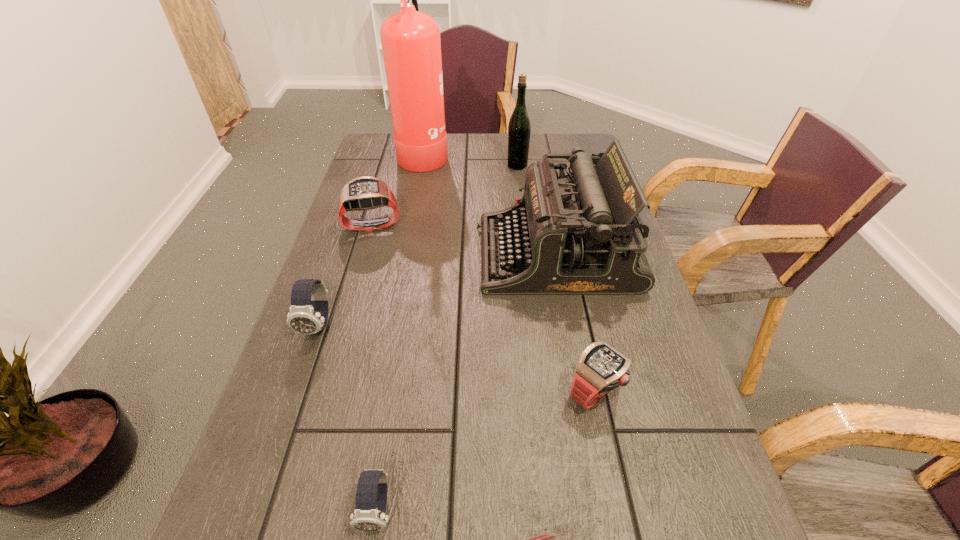
Where is `the right dark watch`? The width and height of the screenshot is (960, 540). the right dark watch is located at coordinates (371, 495).

Find the location of a particular element. This screenshot has width=960, height=540. the fourth farthest watch is located at coordinates (371, 495).

You are a GUI agent. You are given a task and a screenshot of the screen. Output one action in this format:
    pyautogui.click(x=<x>, y=<y>)
    Task: Click on the free point located towards the nozzle of the fire extinguisher
    
    Given the screenshot: What is the action you would take?
    pyautogui.click(x=488, y=153)

In order to click on free spot located on the right of the green beer bottle in this screenshot , I will do `click(584, 165)`.

What are the coordinates of `vacant area situated on the keyboard of the typewriter` in the screenshot? It's located at (384, 255).

Image resolution: width=960 pixels, height=540 pixels. In order to click on vacant space located 0.230m on the keyboard of the typewriter in this screenshot , I will do `click(384, 255)`.

Locate an element on the screen. free region located 0.220m on the keyboard of the typewriter is located at coordinates (388, 255).

The image size is (960, 540). In order to click on vacant space located on the front of the farthest watch in this screenshot , I will do `click(338, 343)`.

I want to click on free region located on the face of the fifth farthest object, so click(x=256, y=508).

Locate an element on the screen. Image resolution: width=960 pixels, height=540 pixels. free point located 0.170m on the front of the second farthest red watch is located at coordinates pyautogui.click(x=623, y=523).